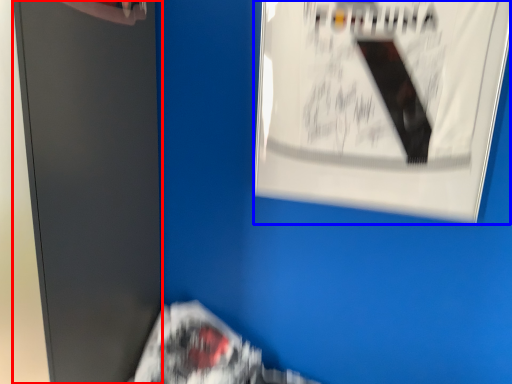
Question: Which object appears farthest to the camera in this image, file cabinet (highlighted by a red box) or poster (highlighted by a blue box)?

Choices:
 (A) file cabinet
 (B) poster

Answer: (B)